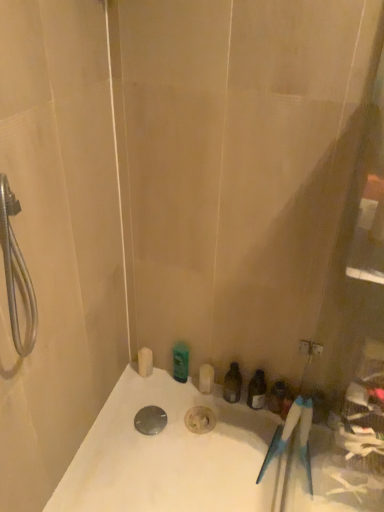
At what (x,y) coordinates should I click in order to perform the action: click on vacant point to the right of white matte soap dispenser at lower left, the 1th toiletry from the left. Please return your answer as a coordinate pair (x, y). Looking at the image, I should click on (178, 392).